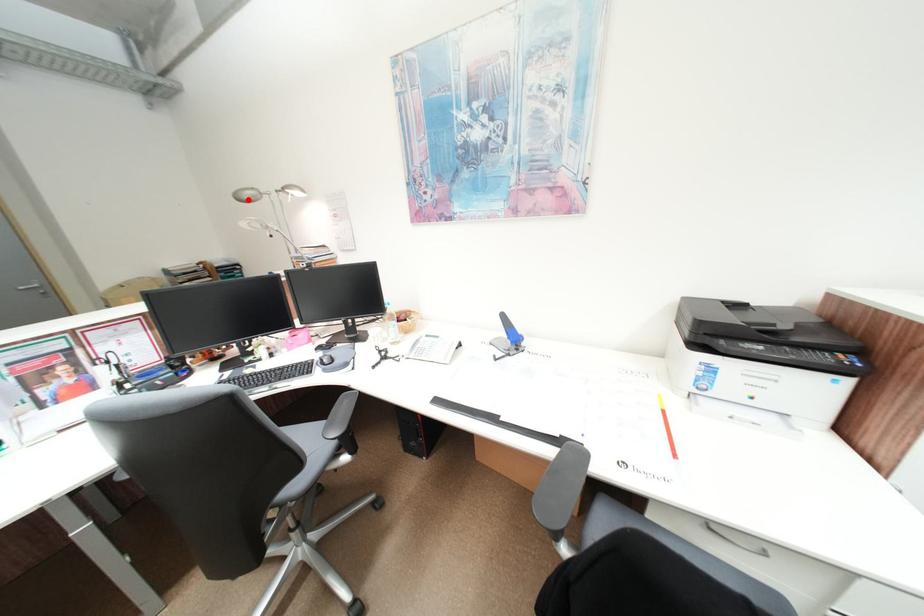
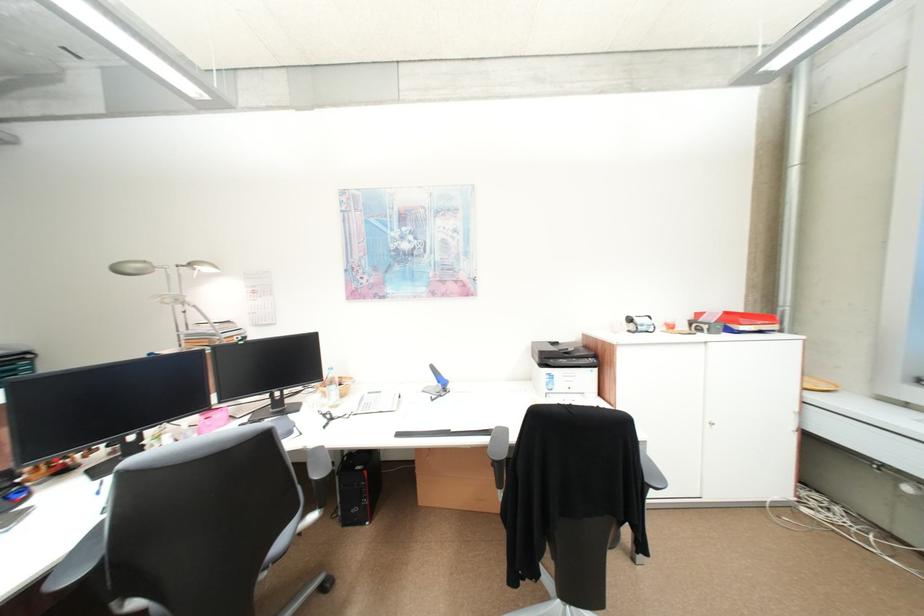
Where in the second image is the point corresponding to the highlighted location from the first image?

(127, 272)